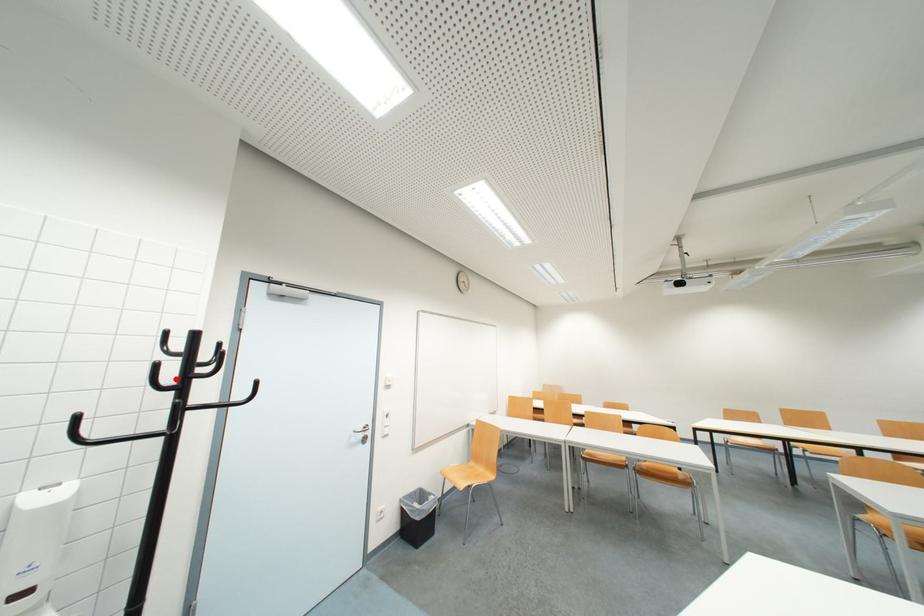
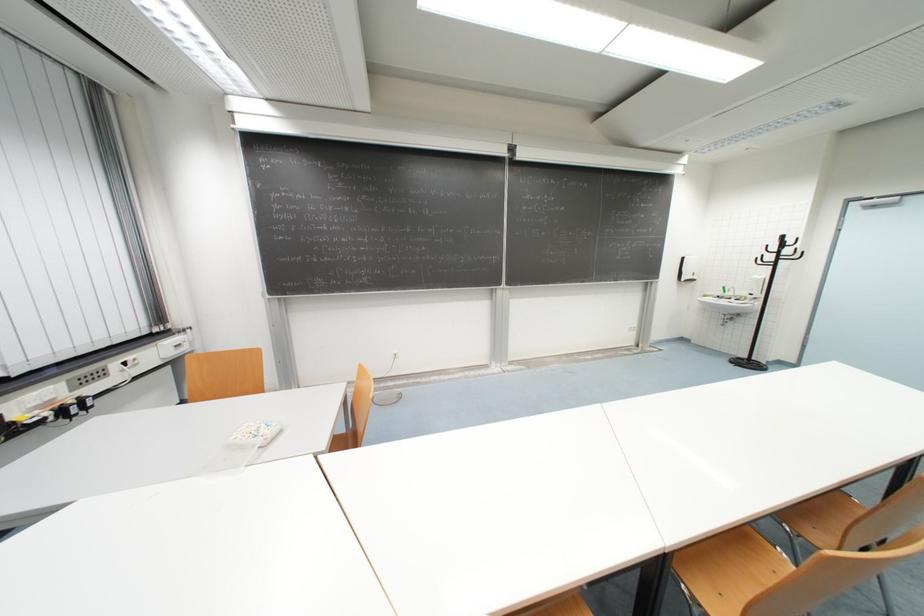
Locate, in the second image, the point that corresponds to the highlighted location in the first image.

(779, 251)